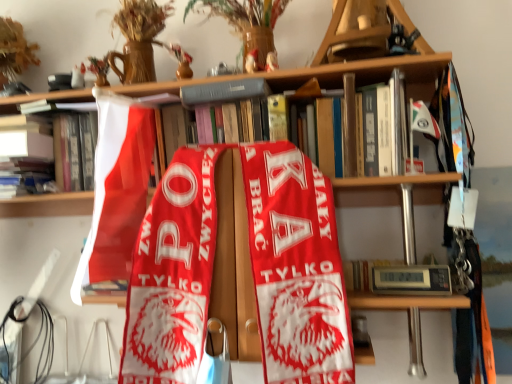
Question: Is red fabric scarf at center oriented towards hardcover book at upper center, the first book in the right-to-left sequence?

Choices:
 (A) yes
 (B) no

Answer: (B)

Question: Considering the relative sizes of red fabric scarf at center and hardcover book at upper center, the first book in the right-to-left sequence, in the image provided, is red fabric scarf at center taller than hardcover book at upper center, the first book in the right-to-left sequence,?

Choices:
 (A) no
 (B) yes

Answer: (B)

Question: Considering the relative positions of red fabric scarf at center and hardcover book at upper center, acting as the third book starting from the left, in the image provided, is red fabric scarf at center in front of hardcover book at upper center, acting as the third book starting from the left,?

Choices:
 (A) yes
 (B) no

Answer: (A)

Question: Does red fabric scarf at center have a larger size compared to hardcover book at upper center, the first book in the right-to-left sequence?

Choices:
 (A) yes
 (B) no

Answer: (A)

Question: Is hardcover book at upper center, acting as the third book starting from the left, at the back of red fabric scarf at center?

Choices:
 (A) yes
 (B) no

Answer: (B)

Question: Based on their sizes in the image, would you say hardcover book at upper center, acting as the third book starting from the left, is bigger or smaller than hardcover book at upper center, which is the second book from left to right?

Choices:
 (A) small
 (B) big

Answer: (A)

Question: Is hardcover book at upper center, the first book in the right-to-left sequence, inside or outside of hardcover book at upper center, which is the second book from left to right?

Choices:
 (A) inside
 (B) outside

Answer: (A)

Question: From the image's perspective, is hardcover book at upper center, the first book in the right-to-left sequence, located above or below hardcover book at upper center, acting as the 2th book starting from the right?

Choices:
 (A) below
 (B) above

Answer: (B)

Question: From a real-world perspective, is hardcover book at upper center, acting as the third book starting from the left, positioned above or below hardcover book at upper center, acting as the 2th book starting from the right?

Choices:
 (A) above
 (B) below

Answer: (A)

Question: From a real-world perspective, relative to matte white book at upper left, which appears as the 1th book when viewed from the left, is hardcover book at upper center, acting as the third book starting from the left, vertically above or below?

Choices:
 (A) above
 (B) below

Answer: (A)

Question: Is hardcover book at upper center, acting as the third book starting from the left, wider or thinner than matte white book at upper left, which appears as the 1th book when viewed from the left?

Choices:
 (A) wide
 (B) thin

Answer: (B)

Question: Is hardcover book at upper center, acting as the third book starting from the left, in front of or behind matte white book at upper left, which appears as the 1th book when viewed from the left, in the image?

Choices:
 (A) front
 (B) behind

Answer: (A)

Question: Considering the positions of point (228, 81) and point (40, 129), is point (228, 81) closer or farther from the camera than point (40, 129)?

Choices:
 (A) farther
 (B) closer

Answer: (B)

Question: From the image's perspective, relative to hardcover book at upper center, acting as the third book starting from the left, is matte white book at upper left, the third book when ordered from right to left, above or below?

Choices:
 (A) below
 (B) above

Answer: (A)

Question: Relative to hardcover book at upper center, the first book in the right-to-left sequence, is matte white book at upper left, which appears as the 1th book when viewed from the left, in front or behind?

Choices:
 (A) front
 (B) behind

Answer: (B)